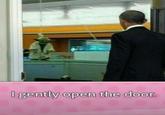
Where is `cubicle`? The image size is (165, 115). cubicle is located at coordinates (90, 74), (66, 66).